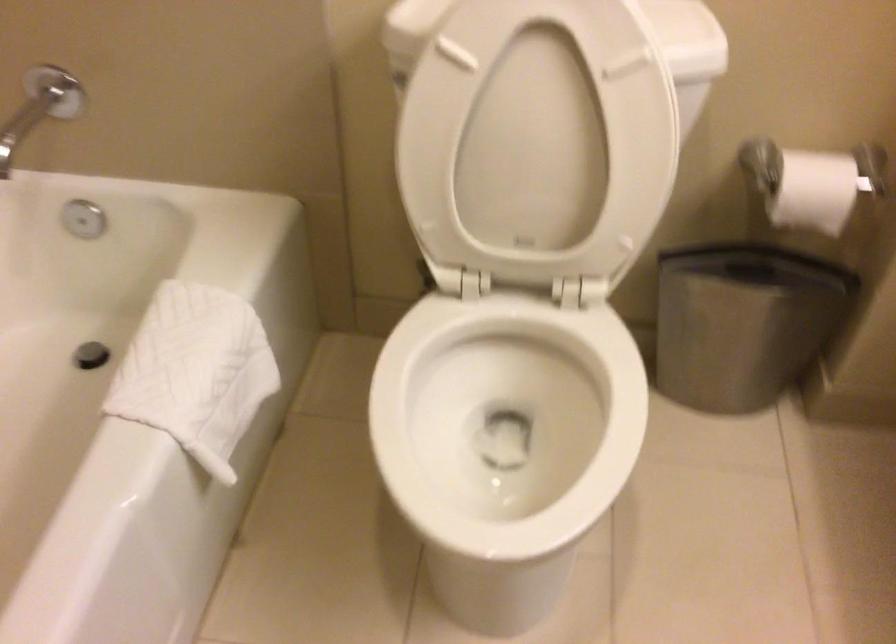
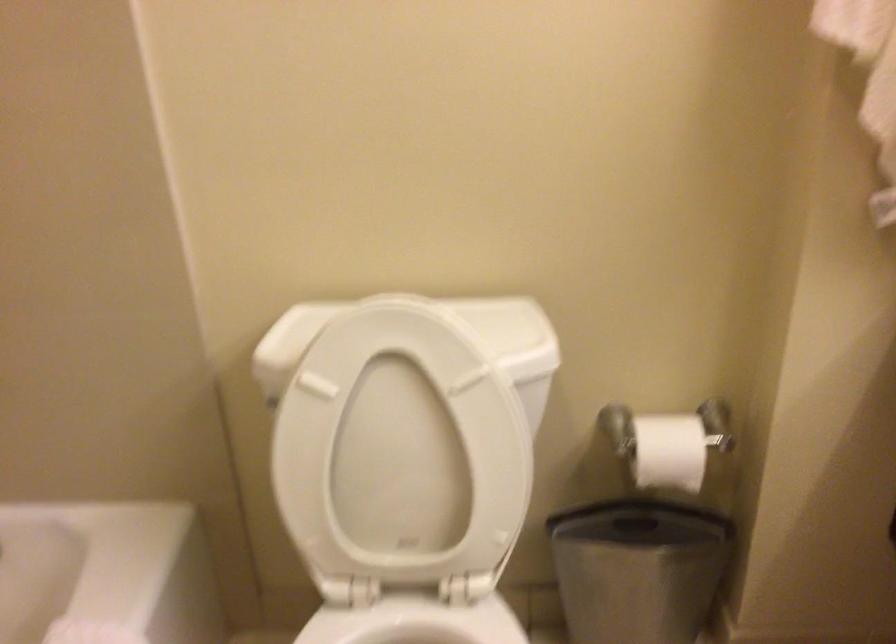
Question: The images are taken continuously from a first-person perspective. In which direction is your viewpoint rotating?

Choices:
 (A) Left
 (B) Right
 (C) Up
 (D) Down

Answer: (C)